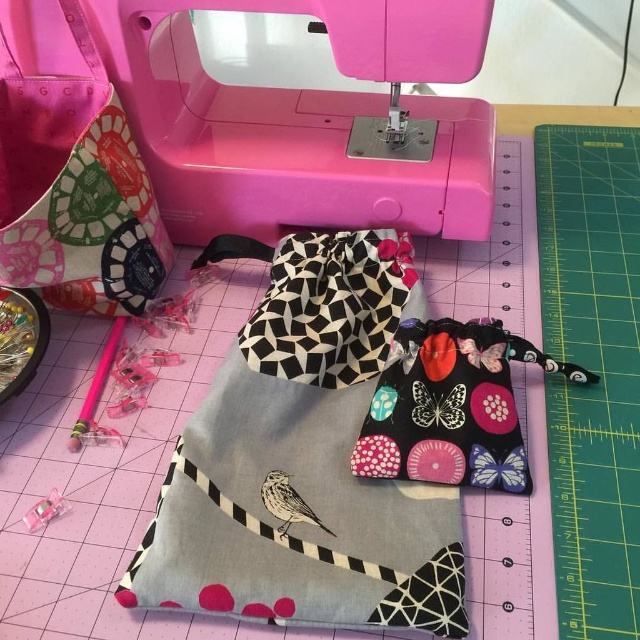
In the scene shown: Does multicolored fabric pouch at upper left have a smaller size compared to black fabric pouch with butterfly prints at center?

No.

Which of these two, multicolored fabric pouch at upper left or black fabric pouch with butterfly prints at center, stands taller?

multicolored fabric pouch at upper left

Find the location of `multicolored fabric pouch at upper left`. multicolored fabric pouch at upper left is located at coordinates (76, 189).

Between pink plastic sewing machine at upper center and multicolored fabric pouch at upper left, which one is positioned higher?

pink plastic sewing machine at upper center is above.

Is pink plastic sewing machine at upper center to the left of multicolored fabric pouch at upper left from the viewer's perspective?

Incorrect, pink plastic sewing machine at upper center is not on the left side of multicolored fabric pouch at upper left.

I want to click on pink plastic sewing machine at upper center, so click(314, 122).

Can you confirm if pink plastic sewing machine at upper center is smaller than black fabric pouch with butterfly prints at center?

Actually, pink plastic sewing machine at upper center might be larger than black fabric pouch with butterfly prints at center.

Does pink plastic sewing machine at upper center appear under black fabric pouch with butterfly prints at center?

Incorrect, pink plastic sewing machine at upper center is not positioned below black fabric pouch with butterfly prints at center.

Is point (456, 196) farther from viewer compared to point (477, 433)?

Yes.

Find the location of a particular element. The width and height of the screenshot is (640, 640). pink plastic sewing machine at upper center is located at coordinates (314, 122).